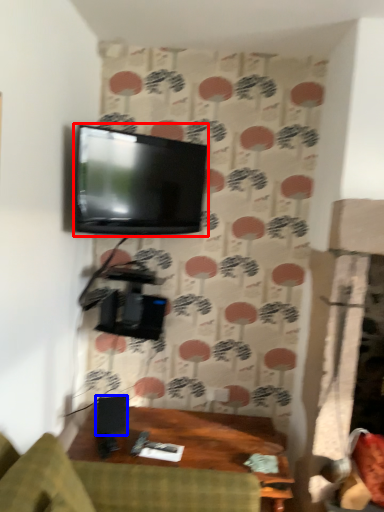
Question: Which object appears farthest to the camera in this image, television (highlighted by a red box) or speaker (highlighted by a blue box)?

Choices:
 (A) television
 (B) speaker

Answer: (B)